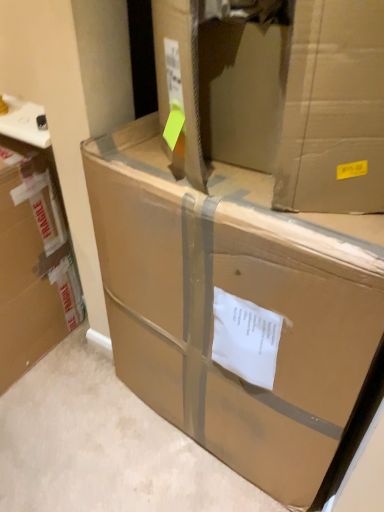
Question: From a real-world perspective, relative to brown cardboard box at center, which ranks as the 1th box in right-to-left order, is brown cardboard box at left, positioned as the second box in right-to-left order, vertically above or below?

Choices:
 (A) above
 (B) below

Answer: (B)

Question: Looking at their shapes, would you say brown cardboard box at left, positioned as the second box in right-to-left order, is wider or thinner than brown cardboard box at center, which is the 2th box from left to right?

Choices:
 (A) thin
 (B) wide

Answer: (A)

Question: Is brown cardboard box at left, positioned as the second box in right-to-left order, inside or outside of brown cardboard box at center, which is the 2th box from left to right?

Choices:
 (A) inside
 (B) outside

Answer: (B)

Question: From a real-world perspective, is brown cardboard box at center, which is the 2th box from left to right, positioned above or below brown cardboard box at left, which is the first box from left to right?

Choices:
 (A) above
 (B) below

Answer: (A)

Question: Is brown cardboard box at center, which is the 2th box from left to right, inside or outside of brown cardboard box at left, positioned as the second box in right-to-left order?

Choices:
 (A) inside
 (B) outside

Answer: (B)

Question: Is brown cardboard box at center, which ranks as the 1th box in right-to-left order, to the left or to the right of brown cardboard box at left, positioned as the second box in right-to-left order, in the image?

Choices:
 (A) right
 (B) left

Answer: (A)

Question: Does point (203, 250) appear closer or farther from the camera than point (46, 178)?

Choices:
 (A) closer
 (B) farther

Answer: (A)